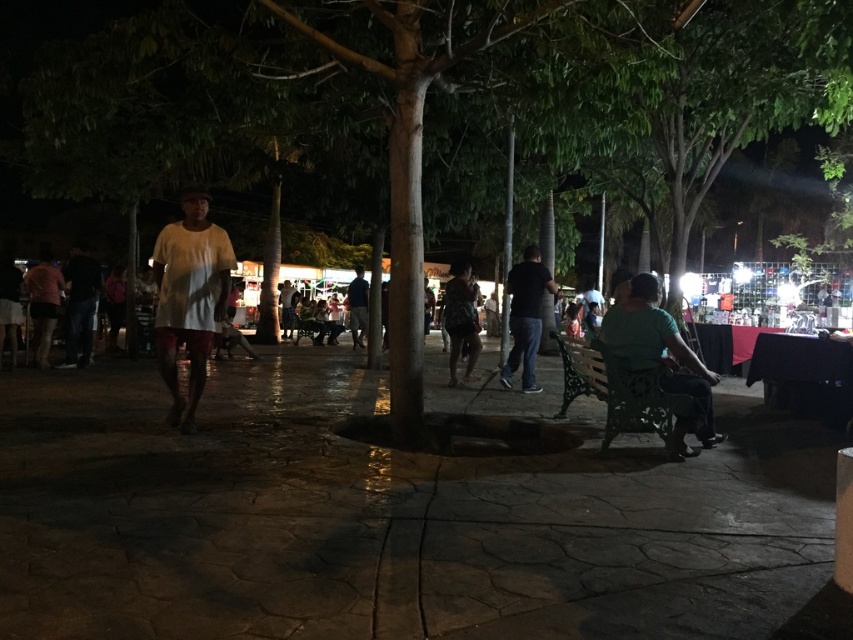
Question: Which object is positioned closest to the dark blue jeans at left?

Choices:
 (A) matte pink shirt at left
 (B) matte black dress at center
 (C) dark blue jeans at center

Answer: (A)

Question: Which of these objects is positioned farthest from the dark blue jeans at left?

Choices:
 (A) dark blue shirt at center
 (B) matte black dress at center
 (C) white matte shirt at center
 (D) green fabric shirt at center

Answer: (D)

Question: Can you confirm if green fabric shirt at center is bigger than matte black dress at center?

Choices:
 (A) yes
 (B) no

Answer: (A)

Question: Does dark blue jeans at center appear on the right side of matte black dress at center?

Choices:
 (A) no
 (B) yes

Answer: (B)

Question: Considering the real-world distances, which object is farthest from the white matte shirt at center?

Choices:
 (A) matte pink shirt at left
 (B) matte black dress at center

Answer: (A)

Question: From the image, what is the correct spatial relationship of dark blue jeans at center in relation to dark blue shirt at center?

Choices:
 (A) left
 (B) right

Answer: (B)